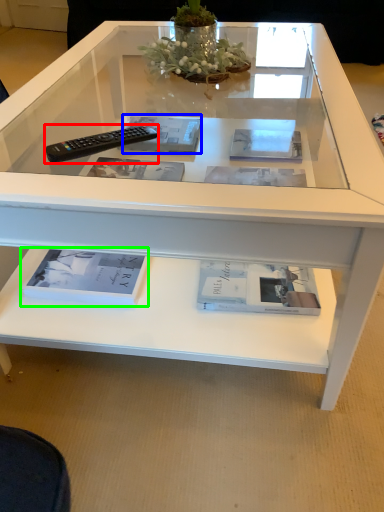
Question: Which object is positioned closest to remote control (highlighted by a red box)? Select from magazine (highlighted by a blue box) and book (highlighted by a green box).

Choices:
 (A) magazine
 (B) book

Answer: (A)